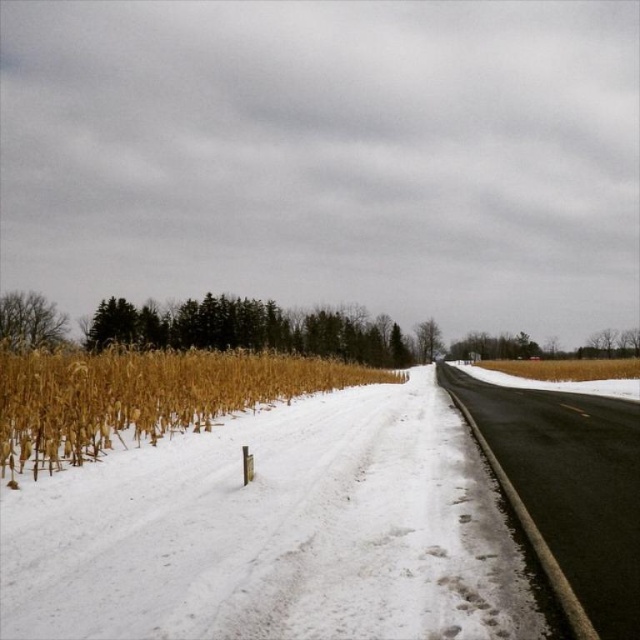
Can you confirm if black asphalt highway at center is thinner than bare branches at left?

Correct, black asphalt highway at center's width is less than bare branches at left's.

At what (x,y) coordinates should I click in order to perform the action: click on black asphalt highway at center. Please return your answer as a coordinate pair (x, y). This screenshot has width=640, height=640. Looking at the image, I should click on (570, 484).

Consider the image. Who is lower down, bare branches at left or green leafy tree at center?

green leafy tree at center is below.

Does bare branches at left come in front of green leafy tree at center?

Yes, it is.

Is point (65, 337) positioned before point (428, 352)?

Yes, it is in front of point (428, 352).

I want to click on bare branches at left, so click(x=29, y=321).

What do you see at coordinates (144, 396) in the screenshot?
I see `golden dry corn at left` at bounding box center [144, 396].

From the picture: Between golden dry corn at left and green leafy tree at center, which one appears on the left side from the viewer's perspective?

golden dry corn at left

The height and width of the screenshot is (640, 640). Describe the element at coordinates (144, 396) in the screenshot. I see `golden dry corn at left` at that location.

Locate an element on the screen. This screenshot has height=640, width=640. golden dry corn at left is located at coordinates (144, 396).